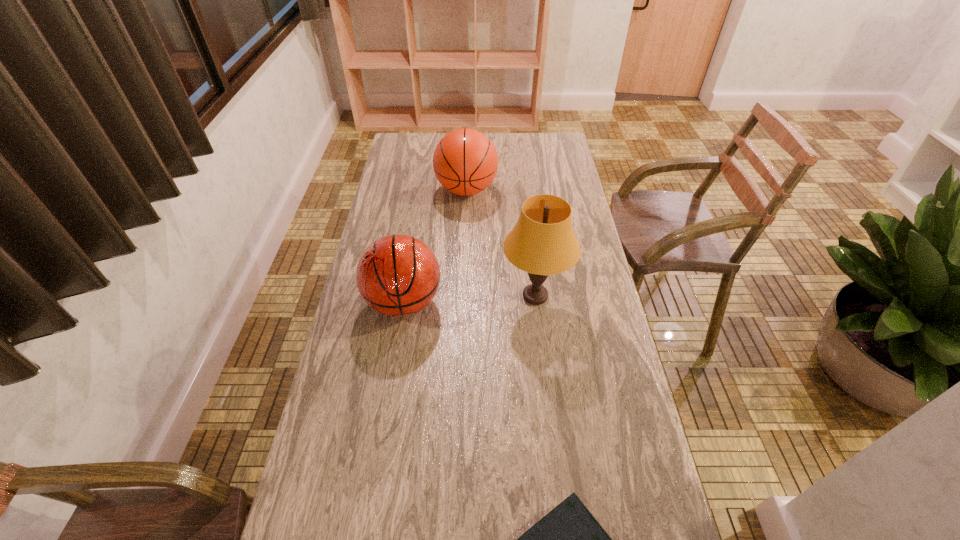
What are the coordinates of `vacant space at the far left corner of the desktop` in the screenshot? It's located at (402, 140).

Where is `free space between the nearer basketball and the farther basketball`? This screenshot has height=540, width=960. free space between the nearer basketball and the farther basketball is located at coordinates (435, 246).

At what (x,y) coordinates should I click in order to perform the action: click on vacant area that lies between the farther basketball and the nearer basketball. Please return your answer as a coordinate pair (x, y). This screenshot has width=960, height=540. Looking at the image, I should click on (435, 246).

Locate an element on the screen. The image size is (960, 540). free spot between the farthest object and the nearer basketball is located at coordinates (435, 246).

Locate an element on the screen. free point between the nearer basketball and the tallest object is located at coordinates (469, 299).

Where is `empty location between the farthest object and the lampshade`? empty location between the farthest object and the lampshade is located at coordinates (501, 243).

What are the coordinates of `the closest object to the farther basketball` in the screenshot? It's located at (542, 243).

This screenshot has width=960, height=540. I want to click on the closest object to the Bible, so click(x=398, y=275).